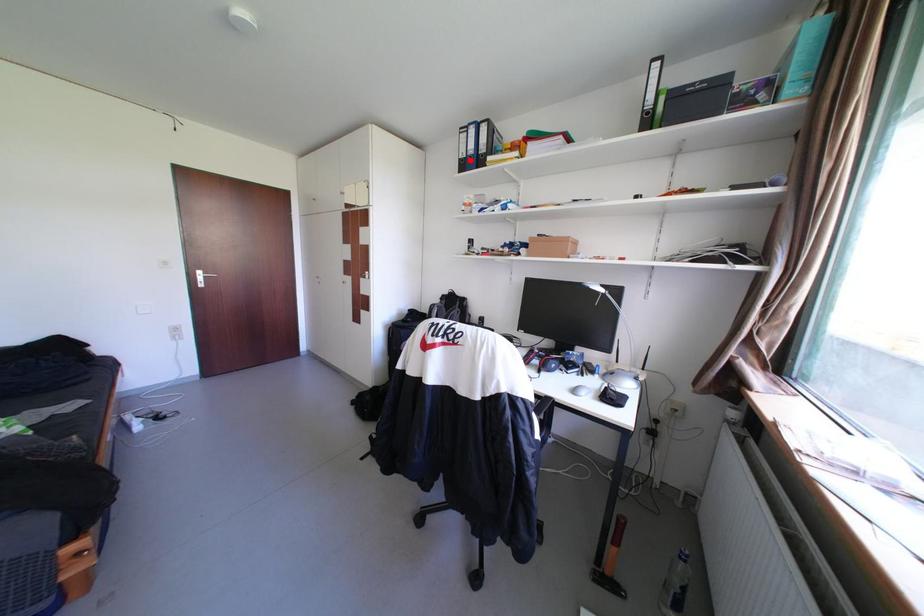
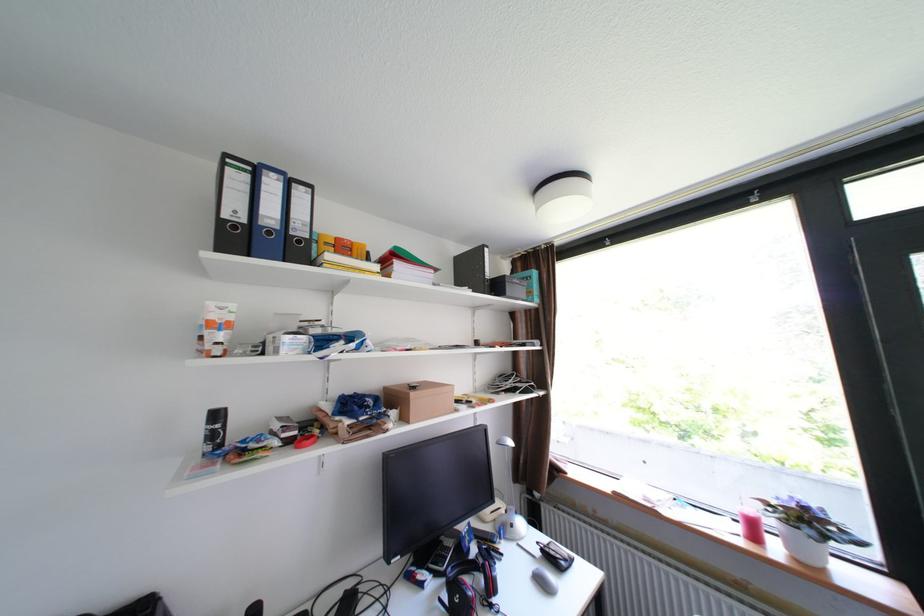
The point at the highlighted location is marked in the first image. Where is the corresponding point in the second image?

(232, 221)